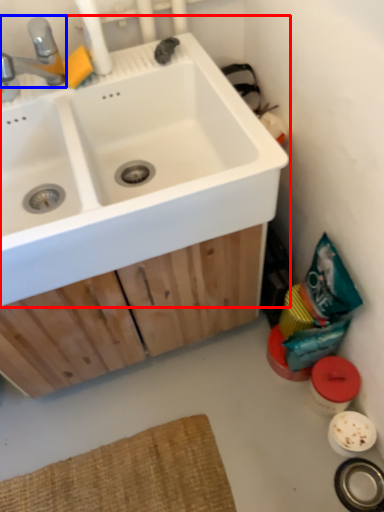
Question: Which of the following is the closest to the observer, sink (highlighted by a red box) or tap (highlighted by a blue box)?

Choices:
 (A) sink
 (B) tap

Answer: (A)